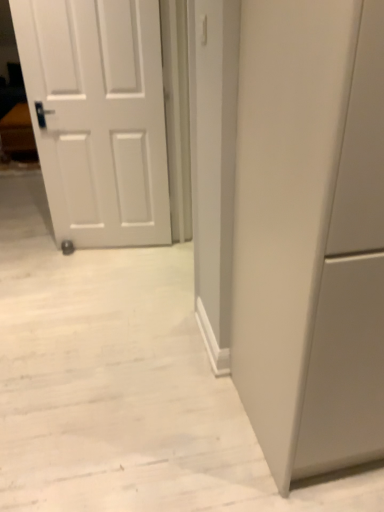
Image resolution: width=384 pixels, height=512 pixels. What do you see at coordinates (310, 233) in the screenshot?
I see `matte gray cabinet at right` at bounding box center [310, 233].

The height and width of the screenshot is (512, 384). What are the coordinates of `matte gray cabinet at right` in the screenshot? It's located at (310, 233).

Where is `matte gray cabinet at right`? This screenshot has height=512, width=384. matte gray cabinet at right is located at coordinates (310, 233).